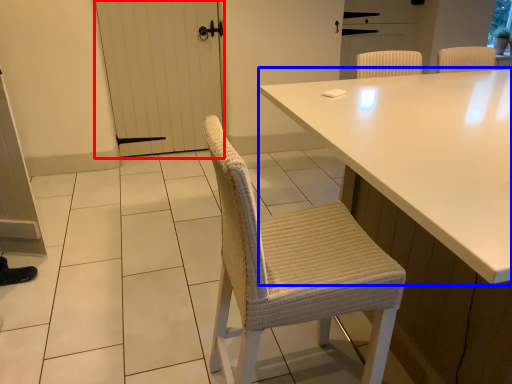
Question: Which of the following is the closest to the observer, screen door (highlighted by a red box) or table (highlighted by a blue box)?

Choices:
 (A) screen door
 (B) table

Answer: (B)